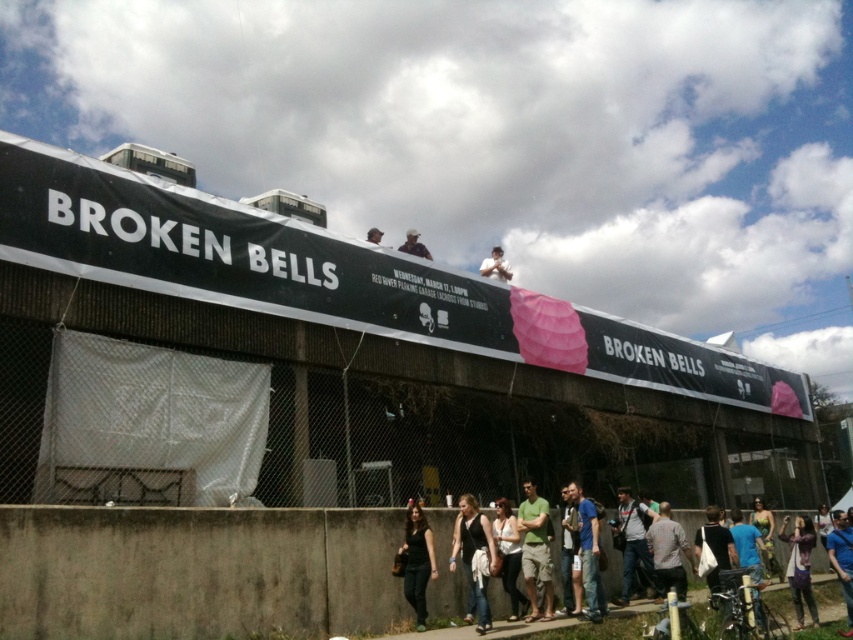
You are a photographer standing in front of the venue named Broken Bells. You notice a matte black shirt at upper center and a matte black hat at upper center. Which object is positioned lower on the building facade?

The matte black shirt at upper center is located below the matte black hat at upper center, so the matte black shirt at upper center is positioned lower on the building facade.

You are standing at the entrance of the venue and notice two shirts hanging on a rack near the door. The shirts are the blue cotton shirt at center and the dark blue shirt at center. If you want to grab both shirts quickly, will you be able to reach them without moving your position?

The blue cotton shirt at center and dark blue shirt at center are 7.94 meters apart, so you will not be able to reach both shirts without moving your position since the distance between them is too large.

You are a fashion designer observing the scene outside Broken Bells. You notice the matte black shirt at upper center and the matte black hat at upper center. Which object has a narrower width?

The matte black shirt at upper center is thinner than the matte black hat at upper center, so the matte black shirt at upper center has a narrower width.